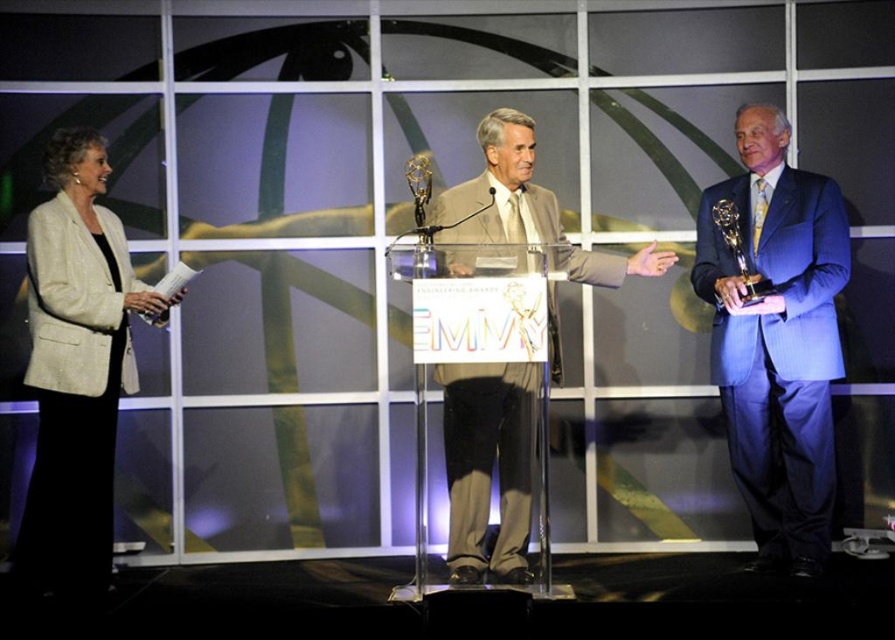
Is blue pinstripe suit at right bigger than light beige fabric jacket at left?

Actually, blue pinstripe suit at right might be smaller than light beige fabric jacket at left.

Consider the image. Can you confirm if blue pinstripe suit at right is taller than light beige fabric jacket at left?

Correct, blue pinstripe suit at right is much taller as light beige fabric jacket at left.

Find the location of a particular element. blue pinstripe suit at right is located at coordinates (777, 339).

Can you confirm if light beige fabric jacket at left is positioned below light beige fabric suit at center?

Yes.

The image size is (895, 640). What do you see at coordinates (77, 368) in the screenshot? I see `light beige fabric jacket at left` at bounding box center [77, 368].

At what (x,y) coordinates should I click in order to perform the action: click on light beige fabric jacket at left. Please return your answer as a coordinate pair (x, y). Image resolution: width=895 pixels, height=640 pixels. Looking at the image, I should click on click(x=77, y=368).

What do you see at coordinates (777, 339) in the screenshot? Image resolution: width=895 pixels, height=640 pixels. I see `blue pinstripe suit at right` at bounding box center [777, 339].

Does blue pinstripe suit at right have a lesser height compared to light beige fabric suit at center?

Incorrect, blue pinstripe suit at right's height does not fall short of light beige fabric suit at center's.

What do you see at coordinates (777, 339) in the screenshot? This screenshot has height=640, width=895. I see `blue pinstripe suit at right` at bounding box center [777, 339].

In order to click on blue pinstripe suit at right in this screenshot , I will do `click(777, 339)`.